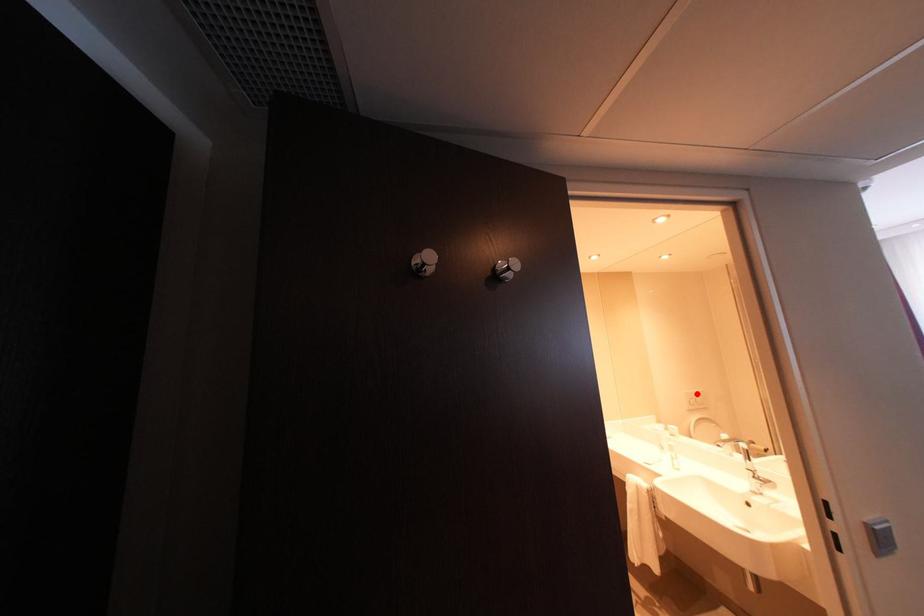
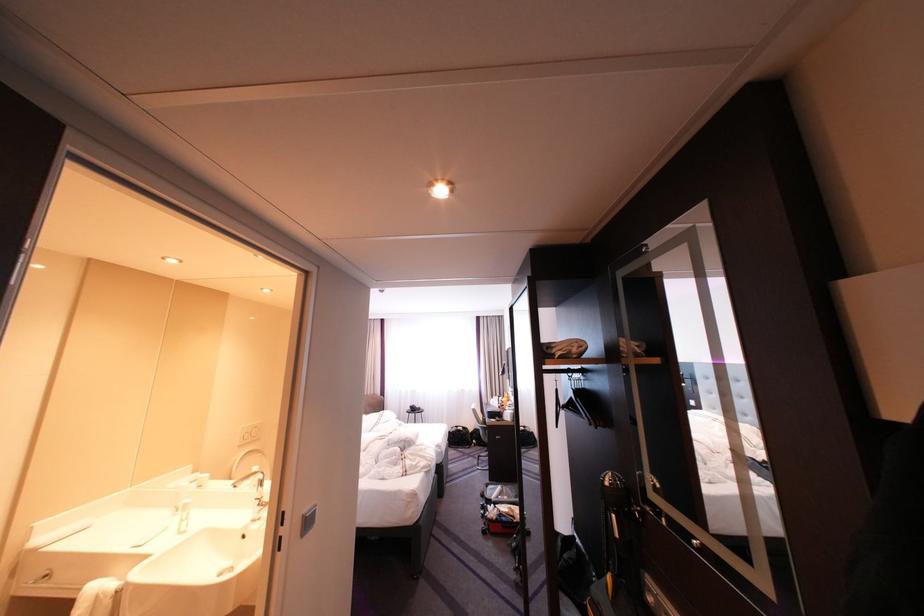
Where in the second image is the point corresponding to the highlighted location from the first image?

(254, 429)